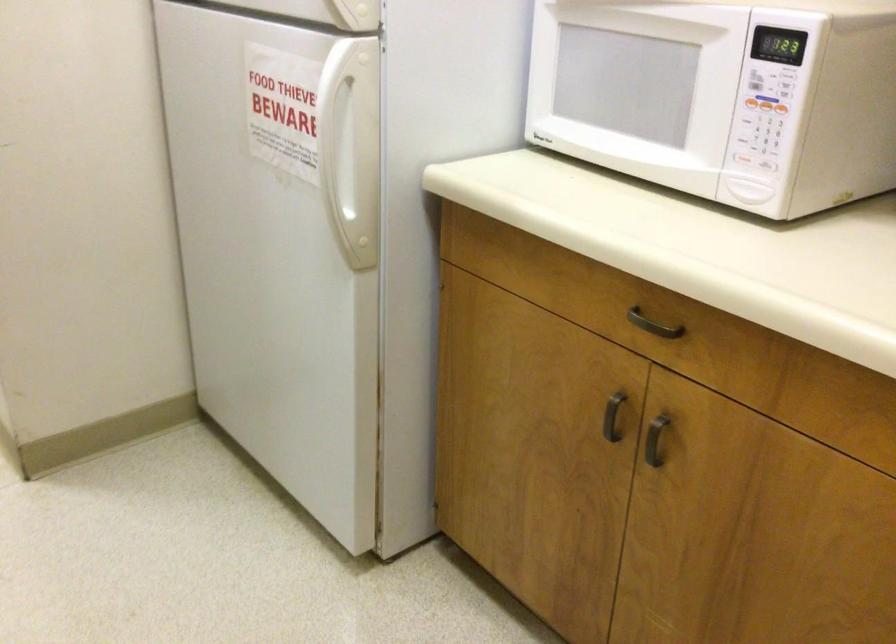
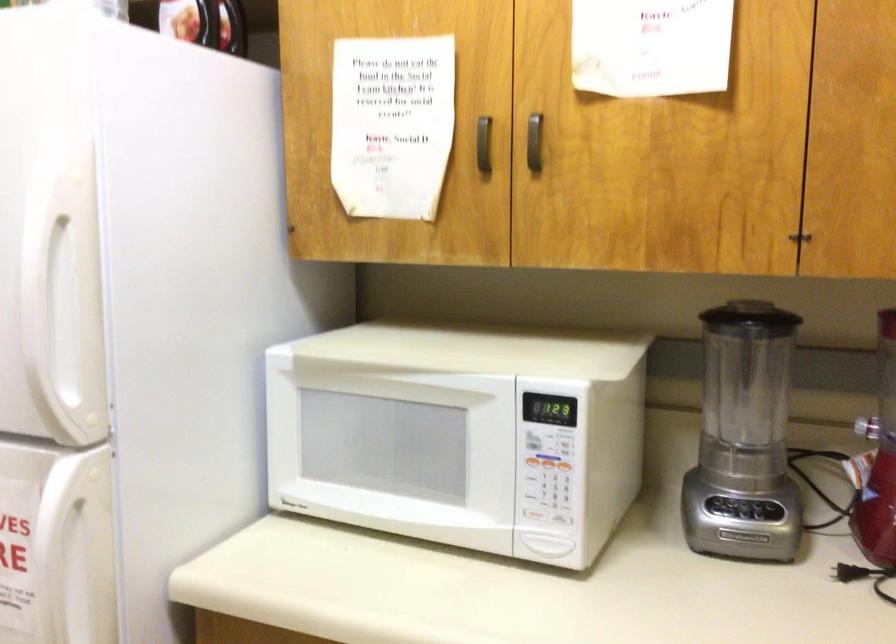
Find the pixel in the second image that matches point 762,98 in the first image.

(547, 462)